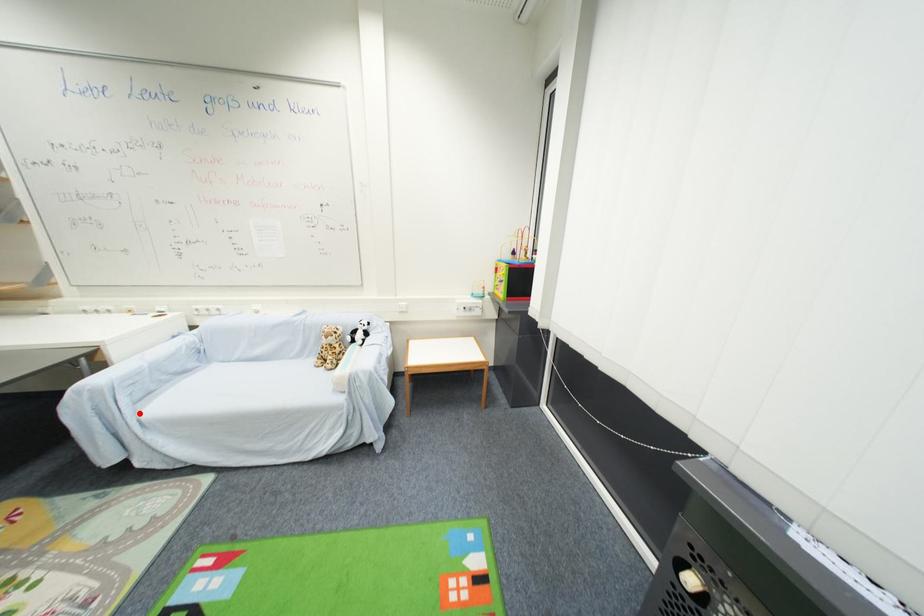
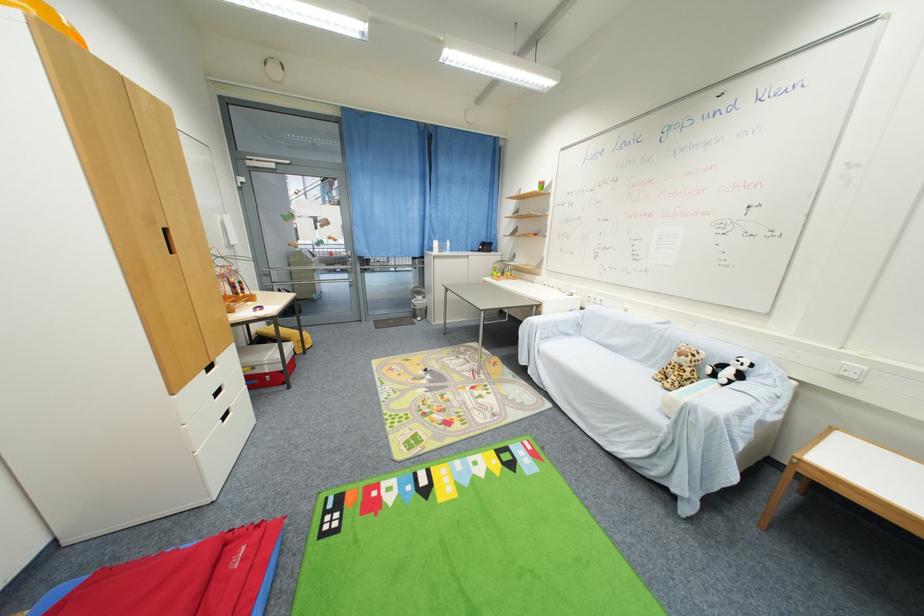
In the second image, find the point that corresponds to the highlighted location in the first image.

(543, 345)